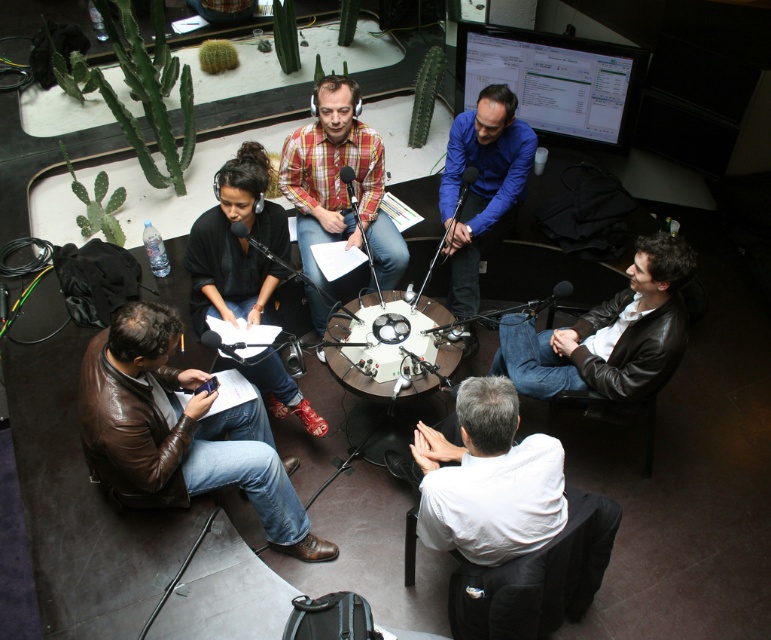
Does brown leather jacket at lower left appear under white glossy round table at center?

Indeed, brown leather jacket at lower left is positioned under white glossy round table at center.

Does point (157, 474) come farther from viewer compared to point (364, 330)?

No.

I want to click on brown leather jacket at lower left, so click(179, 432).

Find the location of a particular element. brown leather jacket at lower left is located at coordinates (179, 432).

Is white matte shirt at lower center to the left of black leather jacket at lower left from the viewer's perspective?

Incorrect, white matte shirt at lower center is not on the left side of black leather jacket at lower left.

Between point (554, 484) and point (244, 200), which one is positioned in front?

Positioned in front is point (554, 484).

Where is `white matte shirt at lower center`? The height and width of the screenshot is (640, 771). white matte shirt at lower center is located at coordinates (487, 477).

Is blue matte shirt at center to the left of white glossy round table at center from the viewer's perspective?

No, blue matte shirt at center is not to the left of white glossy round table at center.

Between blue matte shirt at center and white glossy round table at center, which one has less height?

white glossy round table at center

Identify the location of blue matte shirt at center. (482, 186).